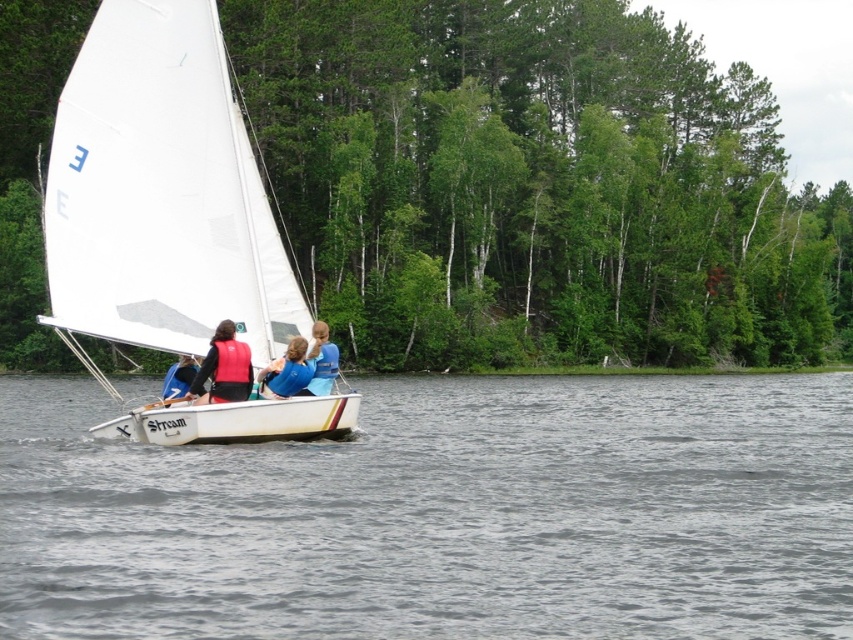
You are a passenger on the white sailboat at center and need to put on your red life vest at center. Which direction should you move to reach it?

The white sailboat at center is located above the red life vest at center, so you should move downward to reach the red life vest at center.

You are standing on the deck of the sailboat and want to check if there is a life vest at the center of the boat. Based on the coordinates provided, can you confirm if the point at (x=224, y=368) is located on the orange life vest at center?

Yes, the point at (x=224, y=368) is located on the orange life vest at center as stated in the description.

You are a photographer on the shore taking pictures of the white sailboat at center and the red life vest at center. Which object should you zoom in on to capture the details of the taller one?

The white sailboat at center is much taller than the red life vest at center, so you should zoom in on the white sailboat at center to capture the details of the taller one.